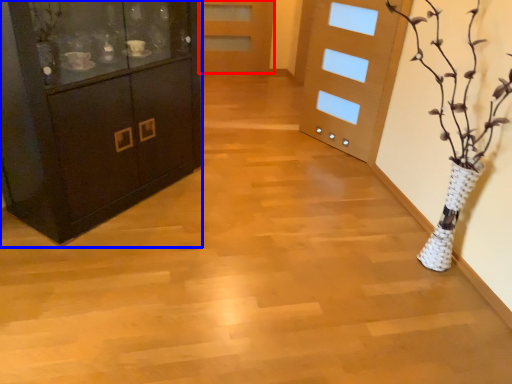
Question: Which object is closer to the camera taking this photo, door (highlighted by a red box) or cabinetry (highlighted by a blue box)?

Choices:
 (A) door
 (B) cabinetry

Answer: (B)